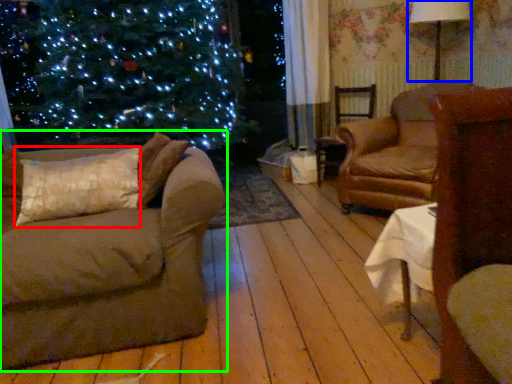
Question: Based on their relative distances, which object is farther from pillow (highlighted by a red box)? Choose from lamp (highlighted by a blue box) and studio couch (highlighted by a green box).

Choices:
 (A) lamp
 (B) studio couch

Answer: (A)